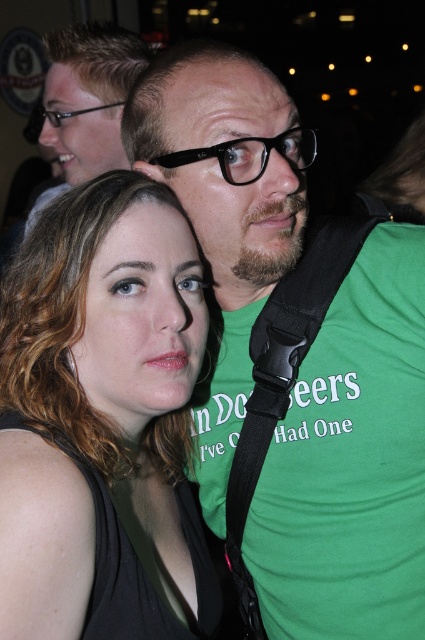
Does green matte shirt at center have a lesser width compared to matte black glasses at upper left?

Yes.

Is point (345, 512) farther from camera compared to point (105, 124)?

That is False.

This screenshot has width=425, height=640. I want to click on green matte shirt at center, so click(x=351, y=464).

The width and height of the screenshot is (425, 640). What are the coordinates of `green matte shirt at center` in the screenshot? It's located at (351, 464).

Which is above, green matte shirt at center or black plastic glasses at center?

black plastic glasses at center is higher up.

What do you see at coordinates (351, 464) in the screenshot?
I see `green matte shirt at center` at bounding box center [351, 464].

Locate an element on the screen. This screenshot has width=425, height=640. green matte shirt at center is located at coordinates (351, 464).

Is point (130, 35) positioned behind point (45, 113)?

No, (130, 35) is closer to viewer.

Is point (110, 113) less distant than point (45, 113)?

Yes.

Identify the location of matte black glasses at upper left. (87, 100).